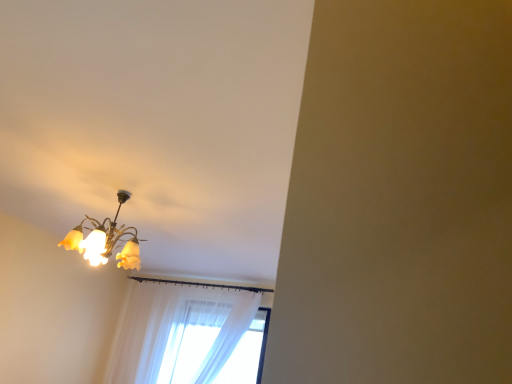
Question: Is matte glass chandelier at upper left in front of or behind sheer white curtain at lower center in the image?

Choices:
 (A) front
 (B) behind

Answer: (A)

Question: From the image's perspective, is matte glass chandelier at upper left located above or below sheer white curtain at lower center?

Choices:
 (A) above
 (B) below

Answer: (A)

Question: Considering the relative positions of matte glass chandelier at upper left and sheer white curtain at lower center in the image provided, is matte glass chandelier at upper left to the left or to the right of sheer white curtain at lower center?

Choices:
 (A) right
 (B) left

Answer: (B)

Question: Is point (227, 342) positioned closer to the camera than point (95, 258)?

Choices:
 (A) farther
 (B) closer

Answer: (A)

Question: In terms of width, does sheer white curtain at lower center look wider or thinner when compared to matte glass chandelier at upper left?

Choices:
 (A) wide
 (B) thin

Answer: (B)

Question: In terms of height, does sheer white curtain at lower center look taller or shorter compared to matte glass chandelier at upper left?

Choices:
 (A) tall
 (B) short

Answer: (A)

Question: In the image, is sheer white curtain at lower center on the left side or the right side of matte glass chandelier at upper left?

Choices:
 (A) right
 (B) left

Answer: (A)